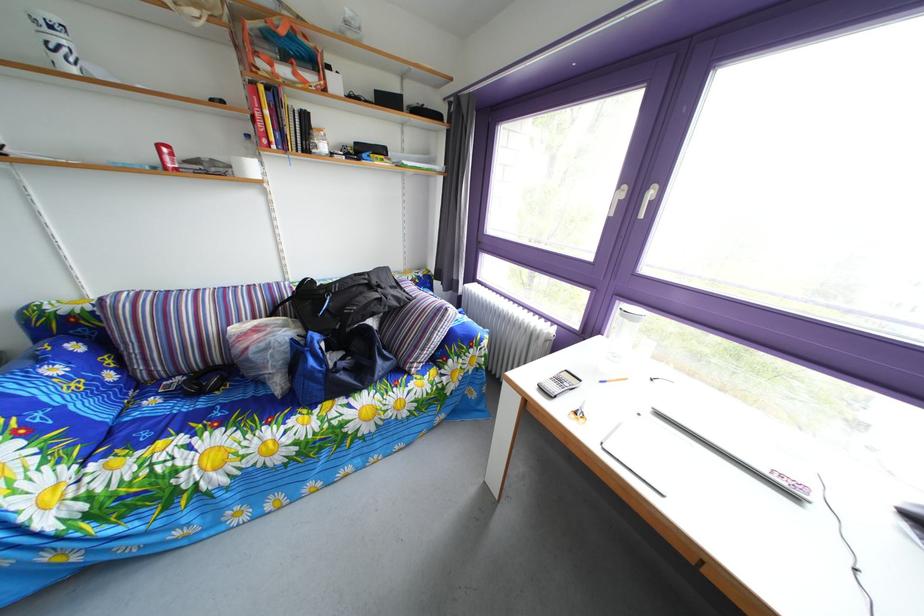
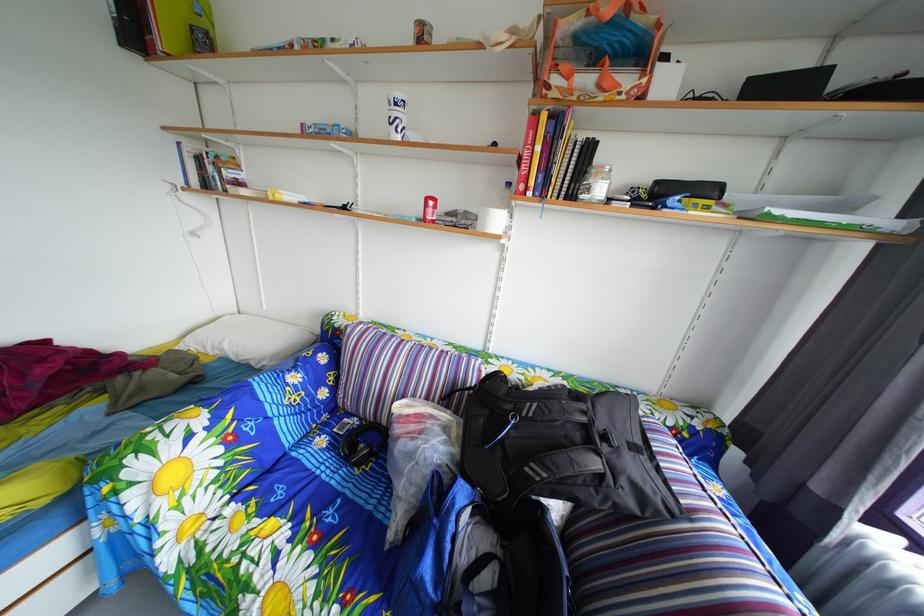
Where in the second image is the point corresponding to [164,436] from the first image?

(301, 493)